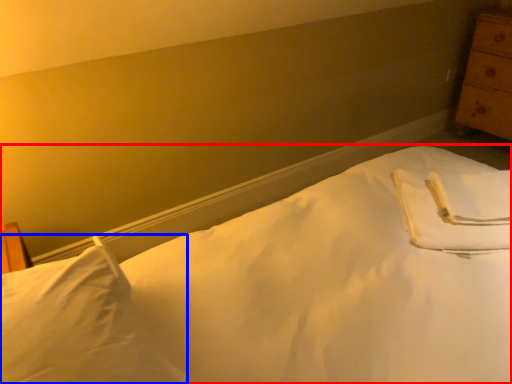
Question: Which object is closer to the camera taking this photo, bed (highlighted by a red box) or pillow (highlighted by a blue box)?

Choices:
 (A) bed
 (B) pillow

Answer: (A)